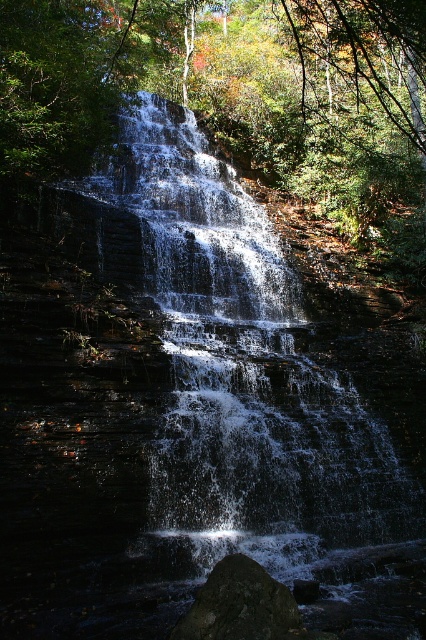
You are a hiker standing at the base of the waterfall. You notice the white frothy water at center and the dark gray rock at center. Which one is higher up the cliff face?

The white frothy water at center is taller than the dark gray rock at center, so the white frothy water at center is higher up the cliff face.

You are a photographer planning to capture the waterfall and its surroundings. You notice the white frothy water at center and the dark gray rock at center. Which object is located more to the left in the image?

The white frothy water at center is positioned on the left side of dark gray rock at center, so it is more to the left in the image.